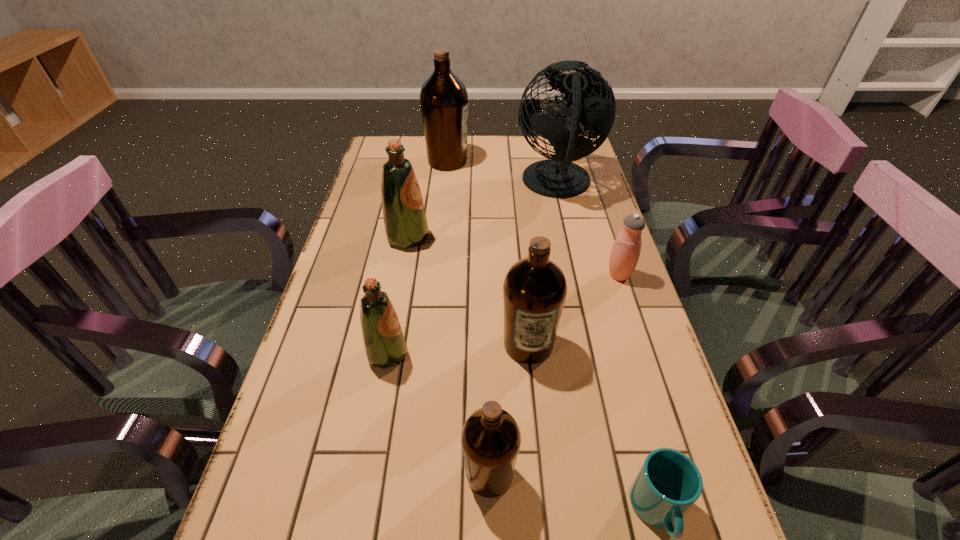
This screenshot has height=540, width=960. Identify the location of vacant space that's between the thermos bottle and the globe. (588, 230).

Identify the location of free point between the second nearest brown olive oil and the farther green olive oil. The width and height of the screenshot is (960, 540). (468, 291).

Image resolution: width=960 pixels, height=540 pixels. Find the location of `free point between the second smallest brown olive oil and the nearest brown olive oil`. free point between the second smallest brown olive oil and the nearest brown olive oil is located at coordinates (509, 409).

Locate which object is the fourth closest to the sixth nearest object. Please provide its 2D coordinates. Your answer should be formatted as a tuple, i.e. [(x, y)], where the tuple contains the x and y coordinates of a point satisfying the conditions above.

[(534, 290)]

Identify the location of object that is the closest to the seventh tallest object. (534, 290).

Identify which olive oil is the nearest to the second biggest brown olive oil. Please provide its 2D coordinates. Your answer should be formatted as a tuple, i.e. [(x, y)], where the tuple contains the x and y coordinates of a point satisfying the conditions above.

[(490, 438)]

Identify which olive oil is the third closest to the fourth farthest object. Please provide its 2D coordinates. Your answer should be formatted as a tuple, i.e. [(x, y)], where the tuple contains the x and y coordinates of a point satisfying the conditions above.

[(490, 438)]

At what (x,y) coordinates should I click in order to perform the action: click on brown olive oil that can be found as the closest to the thermos bottle. Please return your answer as a coordinate pair (x, y). The image size is (960, 540). Looking at the image, I should click on (534, 290).

The image size is (960, 540). Identify the location of brown olive oil that stands as the closest to the sixth nearest object. (444, 100).

This screenshot has width=960, height=540. Identify the location of vacant space that satisfies the following two spatial constraints: 1. on the label of the second farthest brown olive oil; 2. on the label of the smallest brown olive oil. (541, 474).